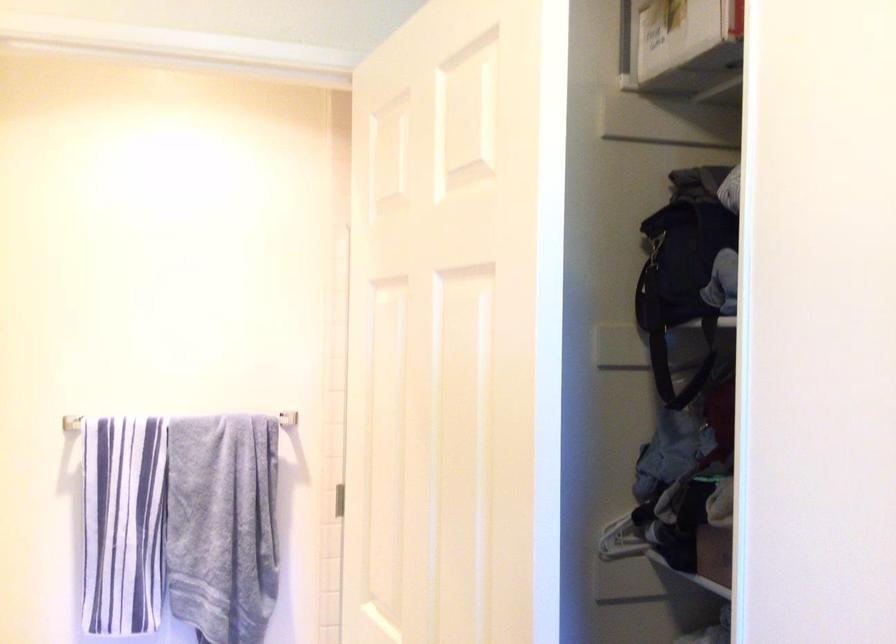
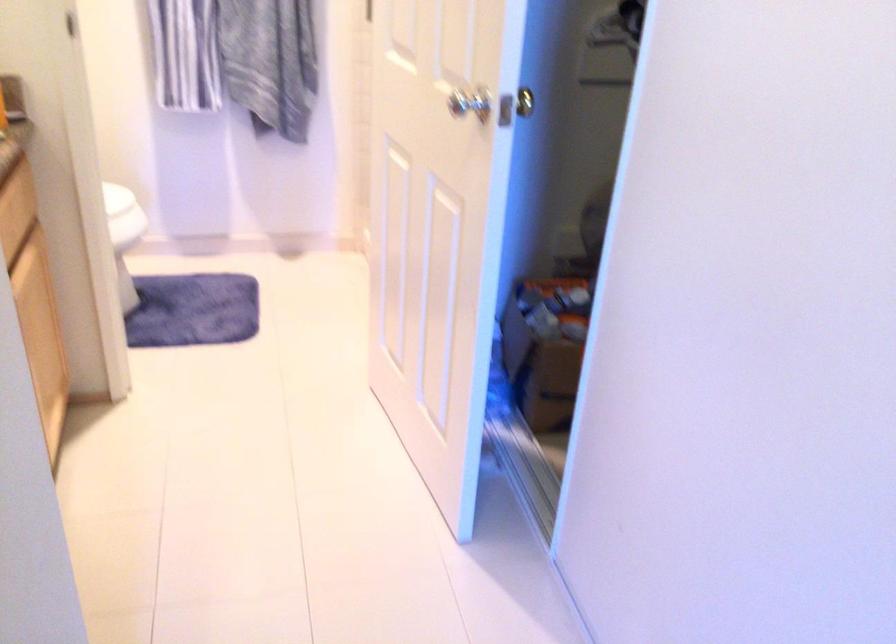
Question: The images are taken continuously from a first-person perspective. In which direction are you moving?

Choices:
 (A) Left
 (B) Right
 (C) Forward
 (D) Backward

Answer: (D)